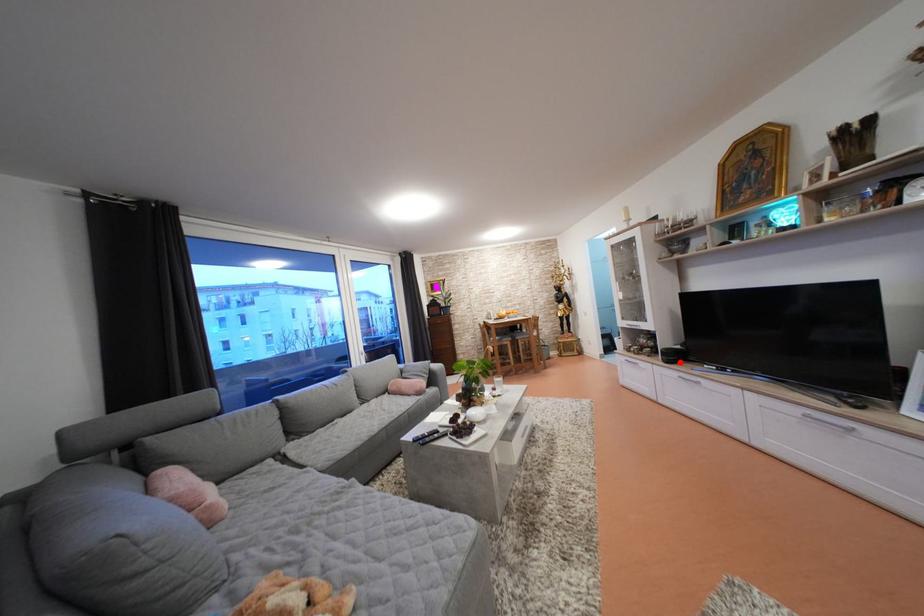
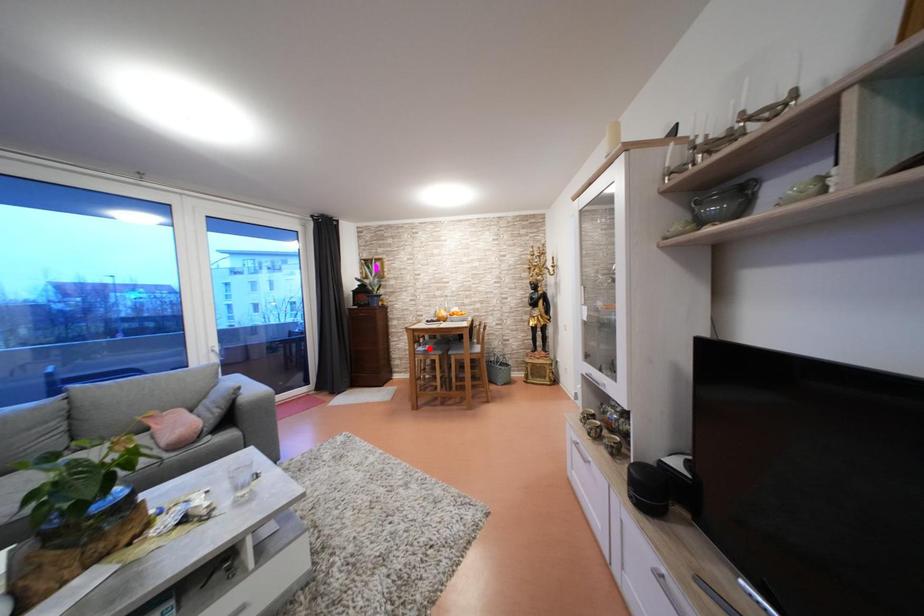
I am providing you with two images of the same scene from different viewpoints. A red point is marked on the first image and another point is marked on the second image. Is the marked point in image1 the same physical position as the marked point in image2?

No